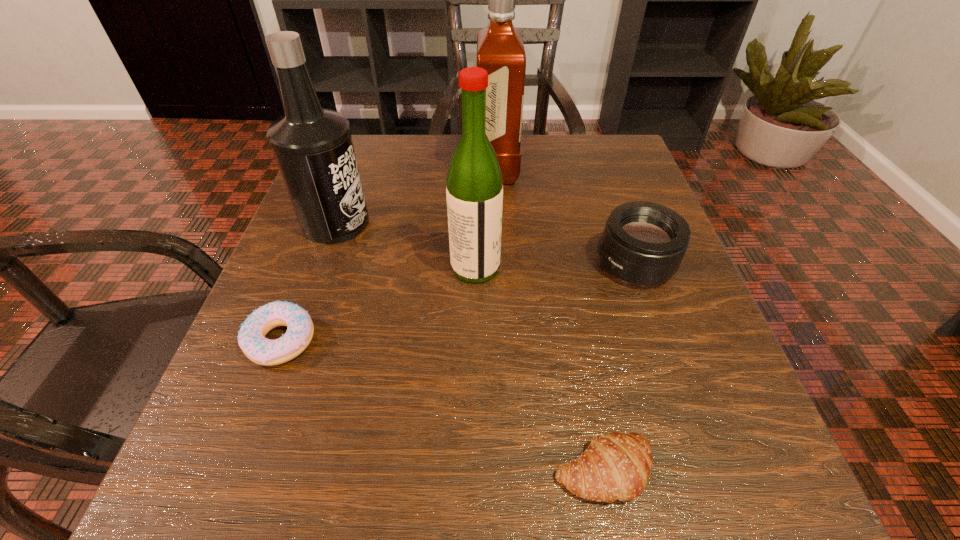
The image size is (960, 540). I want to click on telephoto lens located in the right edge section of the desktop, so click(x=643, y=243).

Where is `crescent roll at the right edge`? This screenshot has width=960, height=540. crescent roll at the right edge is located at coordinates (616, 466).

Image resolution: width=960 pixels, height=540 pixels. In order to click on object located at the near right corner in this screenshot , I will do `click(616, 466)`.

Find the location of `vacant space at the far edge`. vacant space at the far edge is located at coordinates (435, 139).

In the image, there is a desktop. What are the coordinates of `vacant region at the near edge` in the screenshot? It's located at (492, 447).

I want to click on free space at the left edge, so click(x=370, y=210).

In the image, there is a desktop. Where is `vacant space at the right edge`? vacant space at the right edge is located at coordinates (686, 394).

I want to click on free spot at the far left corner of the desktop, so click(381, 163).

Identify the location of blank area at the near left corner. The image size is (960, 540). (289, 501).

You are a GUI agent. You are given a task and a screenshot of the screen. Output one action in this format:
    pyautogui.click(x=<x>, y=<y>)
    Task: Click on the vacant space at the far right corner of the desktop
    Image resolution: width=960 pixels, height=540 pixels.
    Given the screenshot: What is the action you would take?
    pyautogui.click(x=608, y=137)